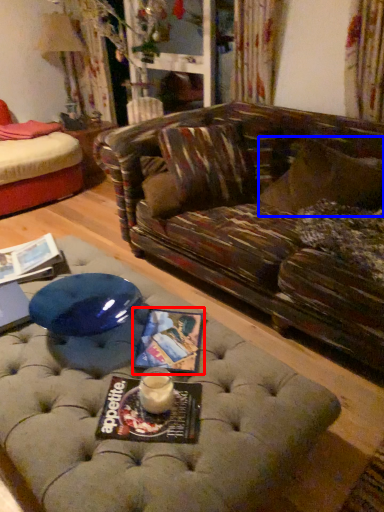
Question: Among these objects, which one is nearest to the camera, magazine (highlighted by a red box) or pillow (highlighted by a blue box)?

Choices:
 (A) magazine
 (B) pillow

Answer: (A)